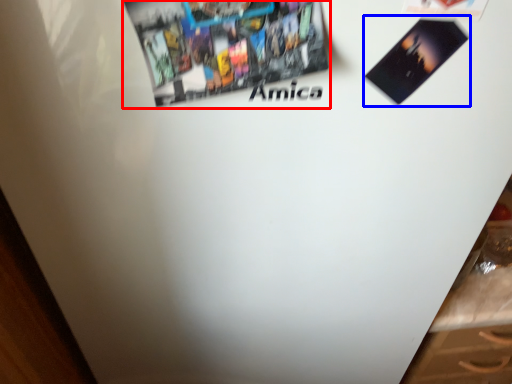
Question: Among these objects, which one is farthest to the camera, poster (highlighted by a red box) or flyer (highlighted by a blue box)?

Choices:
 (A) poster
 (B) flyer

Answer: (B)